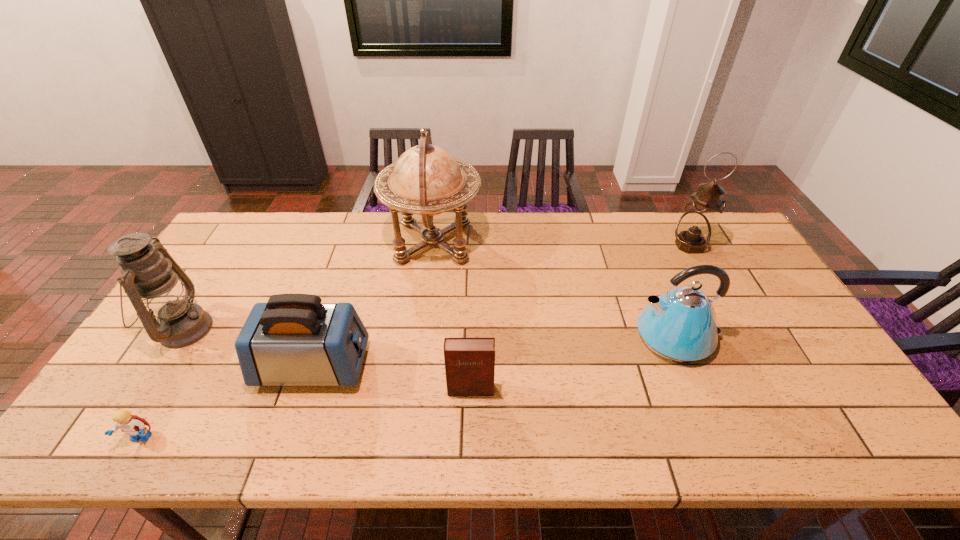
Locate an element on the screen. Lego present at the left edge is located at coordinates (132, 425).

Identify the location of object that is at the right edge. (694, 230).

Locate an element on the screen. The image size is (960, 540). object that is positioned at the near left corner is located at coordinates (132, 425).

You are a GUI agent. You are given a task and a screenshot of the screen. Output one action in this format:
    pyautogui.click(x=<x>, y=<y>)
    Task: Click on the object positioned at the far right corner
    Image resolution: width=960 pixels, height=540 pixels.
    Given the screenshot: What is the action you would take?
    694,230

In the image, there is a desktop. Where is `blank space at the far edge`? The width and height of the screenshot is (960, 540). blank space at the far edge is located at coordinates [x=278, y=237].

The width and height of the screenshot is (960, 540). I want to click on vacant space at the near edge of the desktop, so click(x=672, y=446).

The width and height of the screenshot is (960, 540). In the image, there is a desktop. In order to click on vacant space at the right edge in this screenshot , I will do `click(742, 257)`.

I want to click on free space at the far left corner of the desktop, so click(x=243, y=242).

You are a GUI agent. You are given a task and a screenshot of the screen. Output one action in this format:
    pyautogui.click(x=<x>, y=<y>)
    Task: Click on the vacant region at the near right corner of the desktop
    This screenshot has height=540, width=960.
    Given the screenshot: What is the action you would take?
    pyautogui.click(x=870, y=437)

Where is `vacant point located between the nearest object and the toaster`? The image size is (960, 540). vacant point located between the nearest object and the toaster is located at coordinates (228, 402).